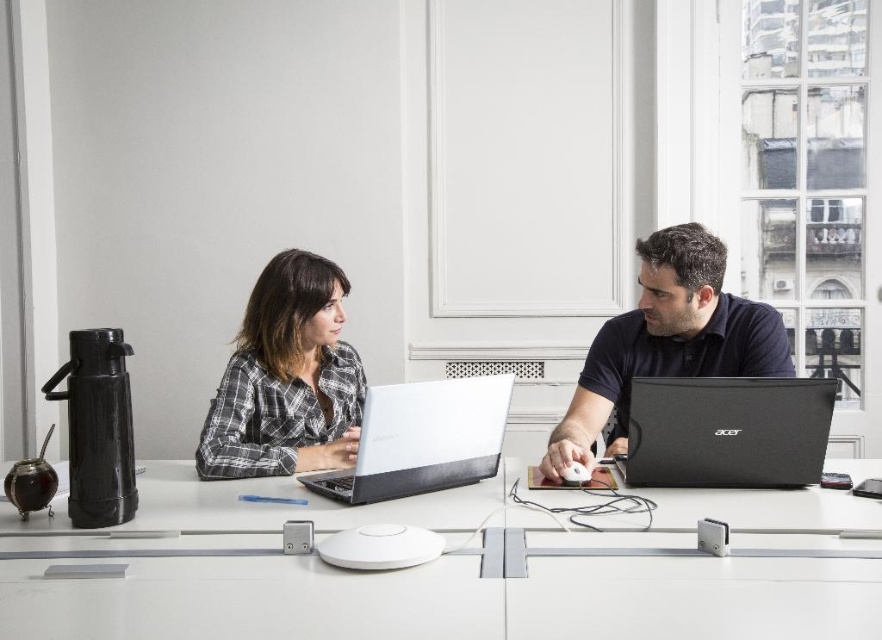
Question: Which object appears farthest from the camera in this image?

Choices:
 (A) white glossy table at center
 (B) black matte laptop at right

Answer: (B)

Question: Is matte silver laptop at center thinner than black matte laptop at center?

Choices:
 (A) yes
 (B) no

Answer: (B)

Question: Can you confirm if white glossy table at center is smaller than matte silver laptop at center?

Choices:
 (A) no
 (B) yes

Answer: (B)

Question: Which of the following is the closest to the observer?

Choices:
 (A) white matte laptop at center
 (B) matte silver laptop at center

Answer: (A)

Question: Does plaid fabric shirt at center appear on the right side of black matte laptop at center?

Choices:
 (A) no
 (B) yes

Answer: (A)

Question: Which point is farther from the camera taking this photo?

Choices:
 (A) (836, 525)
 (B) (237, 456)
 (C) (427, 477)

Answer: (B)